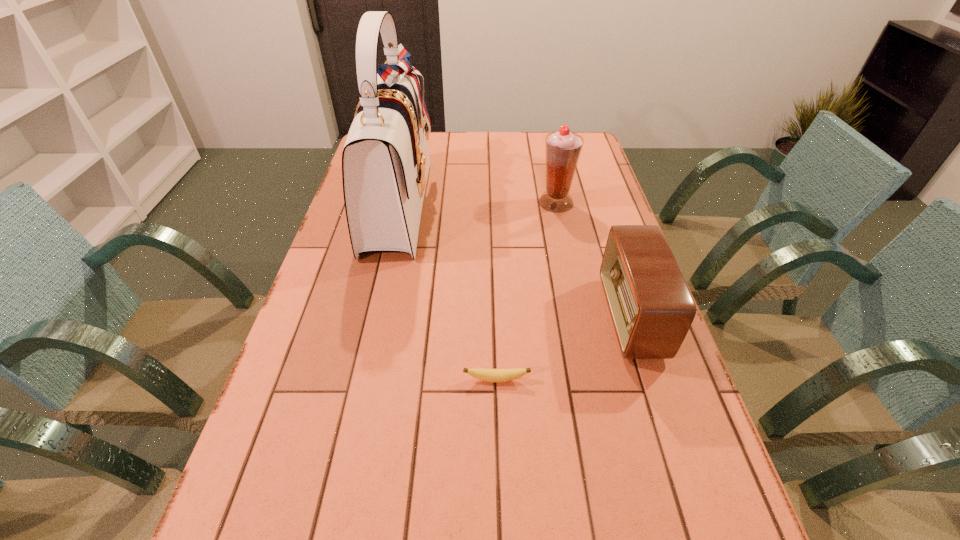
Where is `the tallest object`? the tallest object is located at coordinates (385, 161).

This screenshot has width=960, height=540. I want to click on the leftmost object, so click(385, 161).

At what (x,y) coordinates should I click in order to perform the action: click on smoothie. Please return your answer as a coordinate pair (x, y). The width and height of the screenshot is (960, 540). Looking at the image, I should click on coord(563,148).

The height and width of the screenshot is (540, 960). I want to click on the second tallest object, so click(x=563, y=148).

At what (x,y) coordinates should I click in order to perform the action: click on the second shortest object. Please return your answer as a coordinate pair (x, y). Image resolution: width=960 pixels, height=540 pixels. Looking at the image, I should click on (652, 309).

Find the location of a particular element. radio receiver is located at coordinates (652, 309).

This screenshot has height=540, width=960. What are the coordinates of `the second object from left to right` in the screenshot? It's located at (490, 375).

Identify the location of banana. The width and height of the screenshot is (960, 540). click(490, 375).

In order to click on vacant space located 0.090m on the front-facing side of the leftmost object in this screenshot , I will do pyautogui.click(x=458, y=204).

This screenshot has width=960, height=540. I want to click on vacant space situated 0.110m on the back of the third shortest object, so click(x=550, y=176).